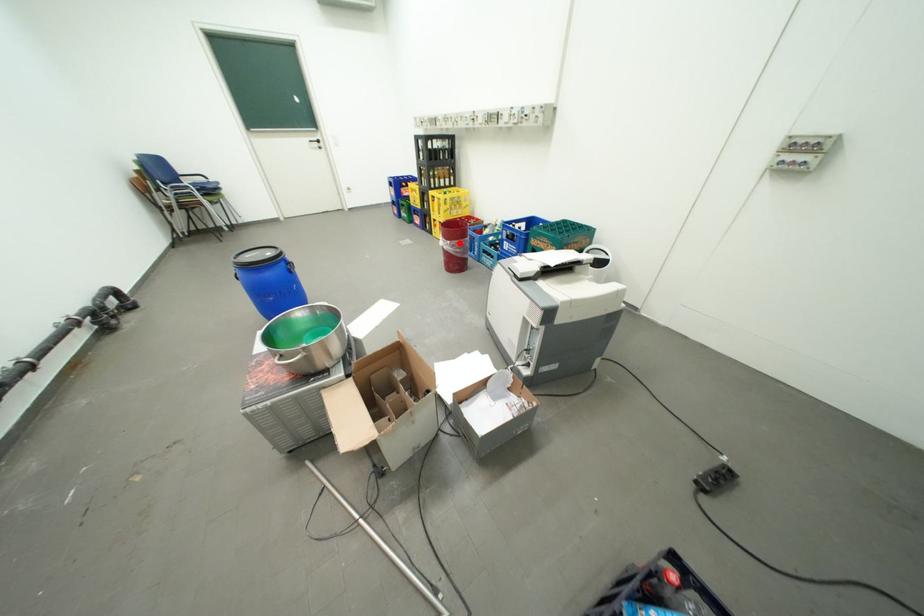
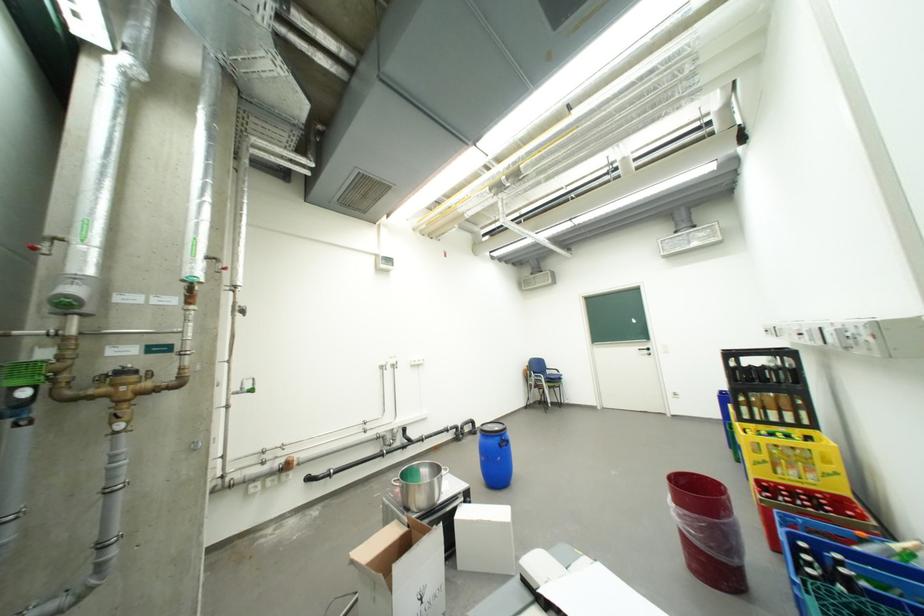
Where in the second image is the point corresponding to the highlighted location from the first image?

(685, 507)